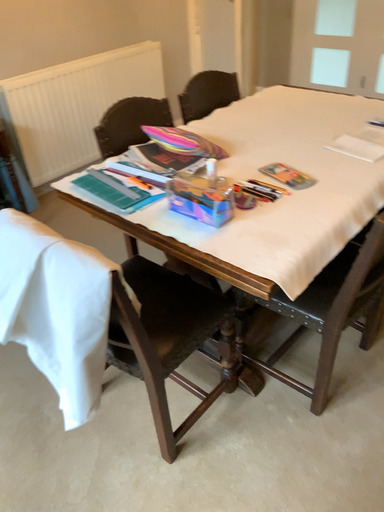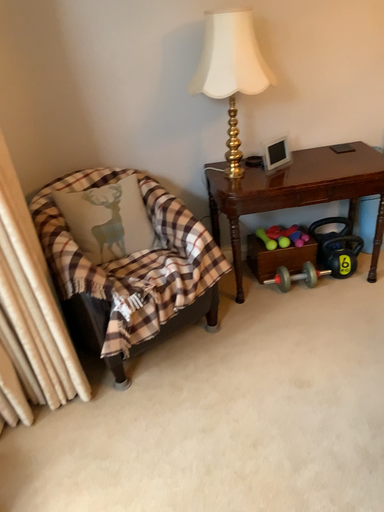
Question: How did the camera likely rotate when shooting the video?

Choices:
 (A) rotated downward
 (B) rotated upward

Answer: (B)